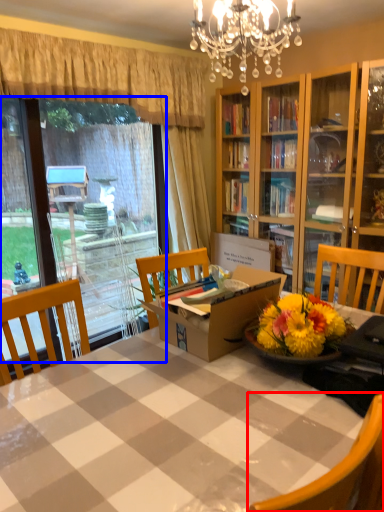
Question: Among these objects, which one is nearest to the camera, chair (highlighted by a red box) or glass door (highlighted by a blue box)?

Choices:
 (A) chair
 (B) glass door

Answer: (A)